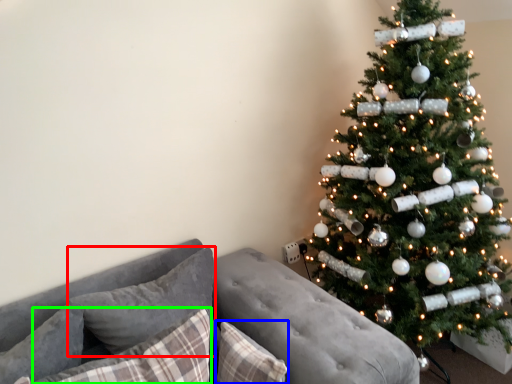
Question: Considering the real-world distances, which object is farthest from pillow (highlighted by a red box)? pillow (highlighted by a blue box) or pillow (highlighted by a green box)?

Choices:
 (A) pillow
 (B) pillow

Answer: (A)